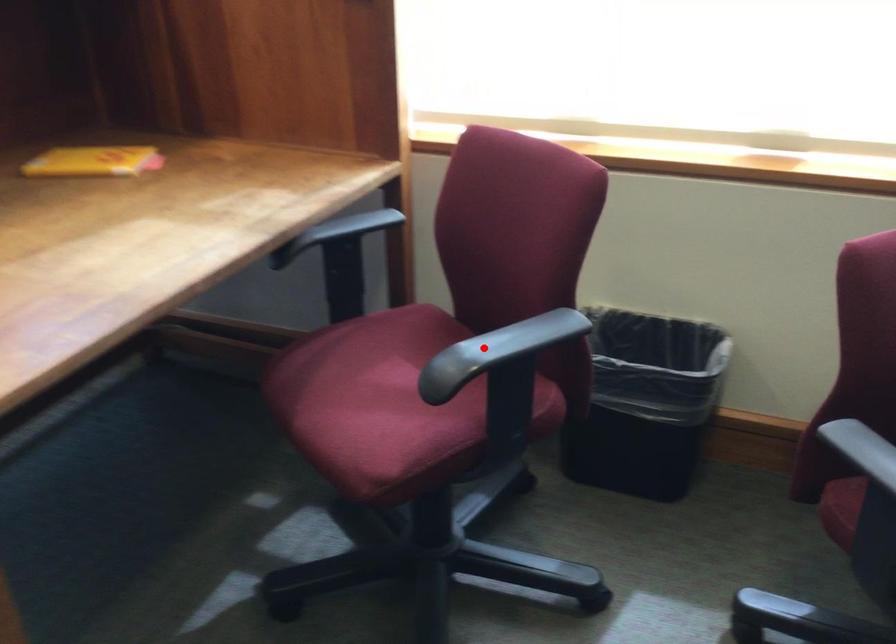
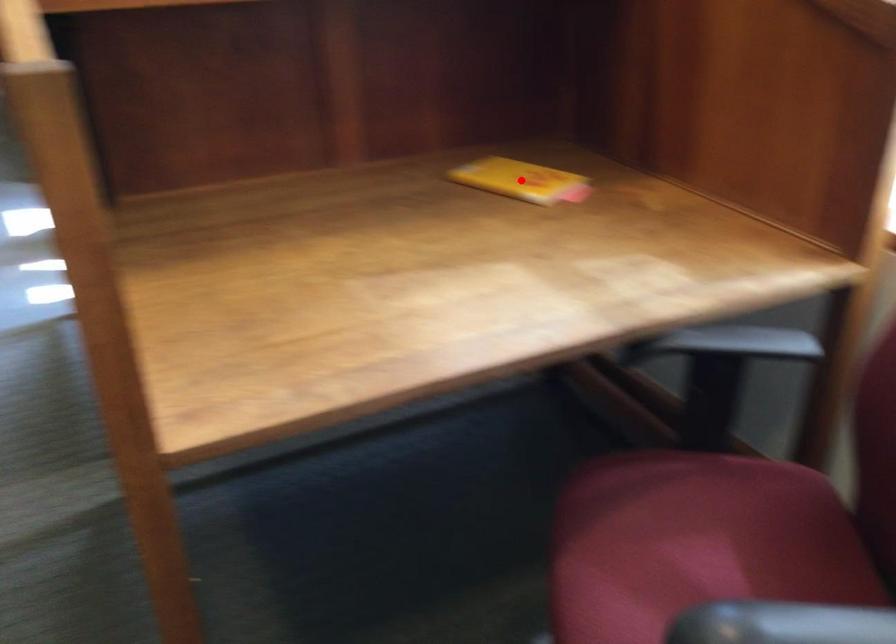
I am providing you with two images of the same scene from different viewpoints. A red point is marked on the first image and another point is marked on the second image. Are the points marked in image1 and image2 representing the same 3D position?

No